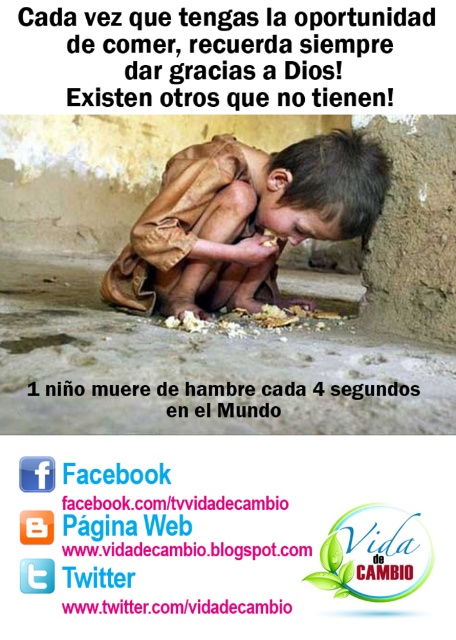
You are a graphic designer working on a poster about gratitude and hunger. You need to ensure that the brown rough cloth at center and the white crumbly bread at center are spaced appropriately for readability. Given that the minimum recommended spacing between elements for readability is 1 inch, is the current spacing sufficient?

The brown rough cloth at center and white crumbly bread at center are 8.68 inches apart, which exceeds the minimum recommended spacing of 1 inch. Therefore, the current spacing is sufficient for readability.

You are a volunteer at a food distribution center. You see a poster with a child eating white crumbly bread at center on a brown rough cloth at center. According to the poster, which item is placed higher?

The brown rough cloth at center is above the white crumbly bread at center, so the brown rough cloth at center is placed higher.